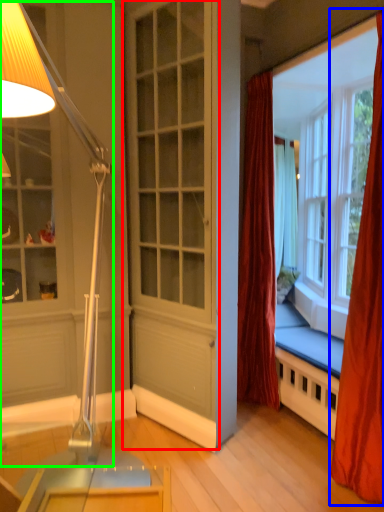
Question: Which object is the farthest from screen door (highlighted by a red box)? Choose among these: curtain (highlighted by a blue box) or lamp (highlighted by a green box).

Choices:
 (A) curtain
 (B) lamp

Answer: (A)